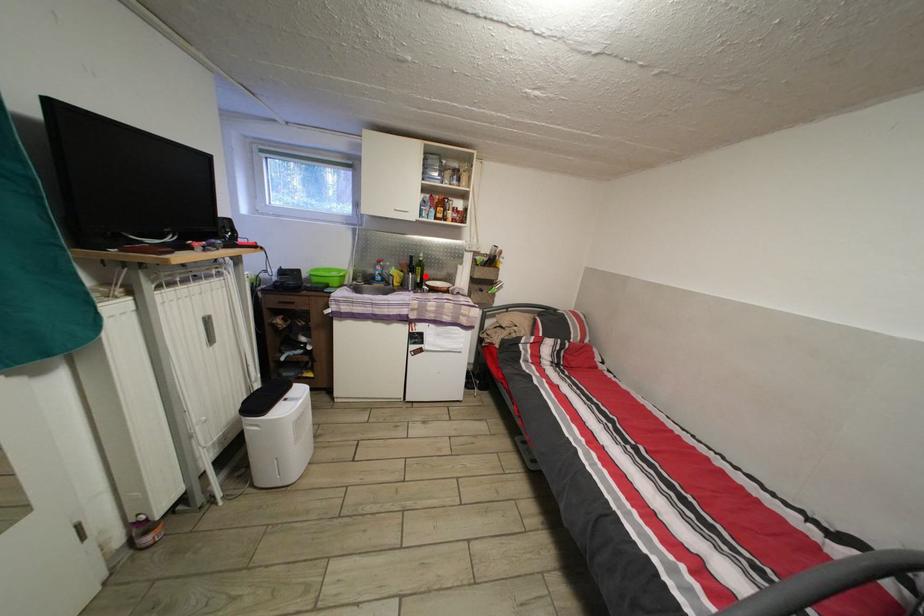
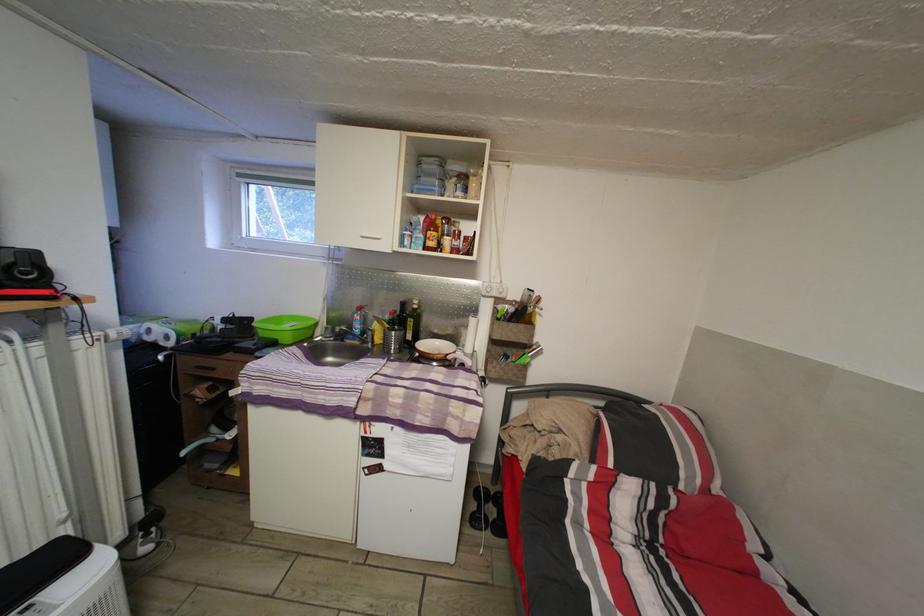
The point at the highlighted location is marked in the first image. Where is the corresponding point in the second image?

(418, 329)